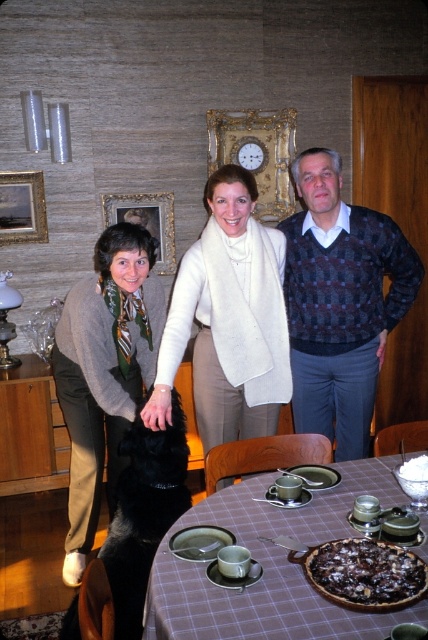
You are a photographer setting up for a photo shoot in this living room. You need to ensure that both the matte beige sweater at center and the white frosted cake at table center are visible in the frame. Given their sizes, which object should you position closer to the camera to maintain their visibility without distortion?

The matte beige sweater at center is taller than the white frosted cake at table center. To maintain visibility without distortion, position the white frosted cake at table center closer to the camera since it is shorter and requires less space in the frame.

You are a photographer standing at the camera position. You want to take a closeup shot of the white knitted scarf at center. Can you reach it with your hand without moving from your current position?

The white knitted scarf at center is 2.03 meters from camera, so you cannot reach it with your hand without moving from your current position.

You are a guest in this living room and want to place a small vase on the plaid fabric table at center. However, you notice the matte gray sweater at left nearby. Considering their heights, will the vase be visible above the sweater?

The plaid fabric table at center has a lesser height compared to matte gray sweater at left, so the vase placed on the plaid fabric table at center will be partially or fully obscured by the matte gray sweater at left, making it less visible.